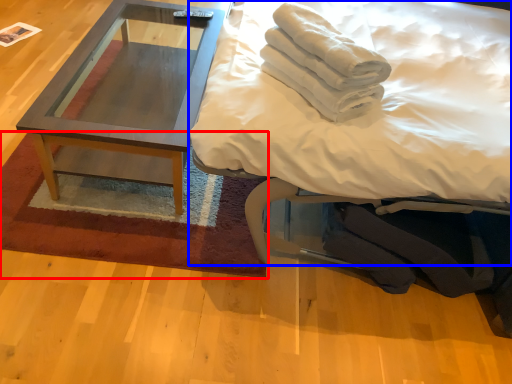
Question: Among these objects, which one is farthest to the camera, mat (highlighted by a red box) or bed (highlighted by a blue box)?

Choices:
 (A) mat
 (B) bed

Answer: (A)